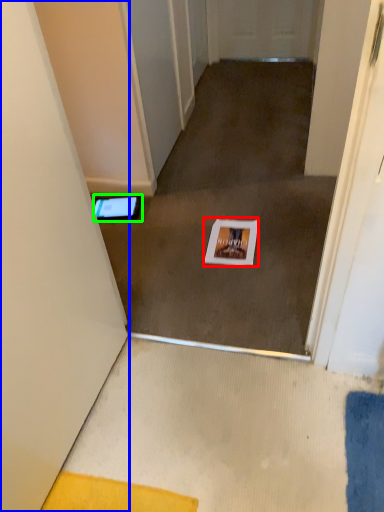
Question: Which object is positioned farthest from postcard (highlighted by a red box)? Select from door (highlighted by a blue box) and tablet computer (highlighted by a green box).

Choices:
 (A) door
 (B) tablet computer

Answer: (A)